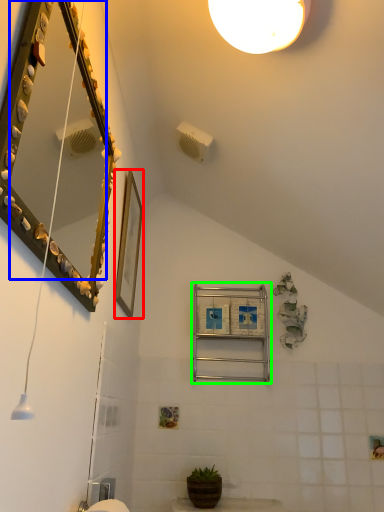
Question: Estimate the real-world distances between objects in this image. Which object is closer to picture frame (highlighted by a red box), mirror (highlighted by a blue box) or ladder (highlighted by a green box)?

Choices:
 (A) mirror
 (B) ladder

Answer: (A)